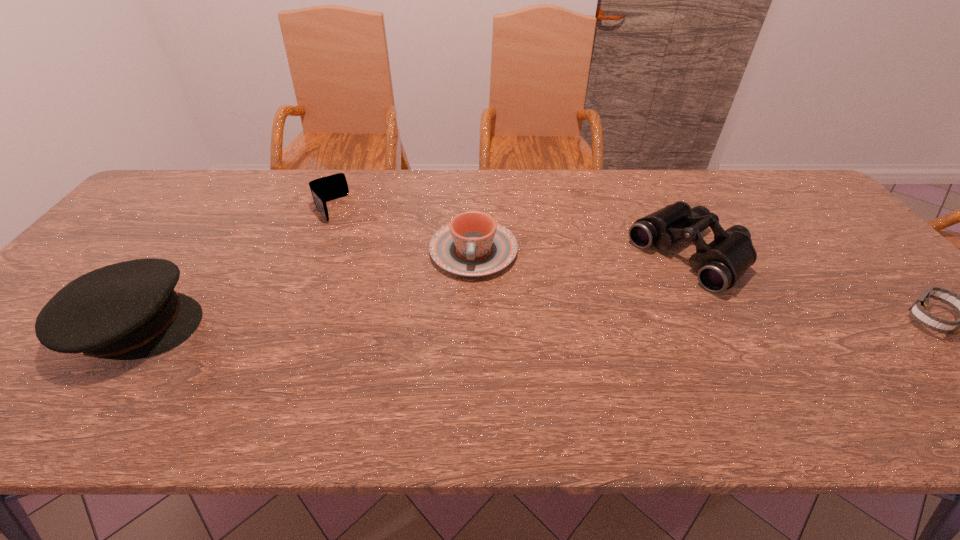
This screenshot has width=960, height=540. I want to click on vacant space at the right edge of the desktop, so click(x=816, y=259).

You are a GUI agent. You are given a task and a screenshot of the screen. Output one action in this format:
    pyautogui.click(x=<x>, y=<y>)
    Task: Click on the vacant region at the far left corner
    This screenshot has height=540, width=960.
    Given the screenshot: What is the action you would take?
    pyautogui.click(x=155, y=211)

Locate an element on the screen. The height and width of the screenshot is (540, 960). free area in between the second object from right to left and the beret is located at coordinates (413, 292).

Locate an element on the screen. free space that is in between the binoculars and the chinaware is located at coordinates (582, 254).

Locate an element on the screen. The image size is (960, 540). free point between the third object from right to left and the leftmost object is located at coordinates 305,289.

In order to click on empty space that is in between the beret and the chinaware in this screenshot , I will do `click(305, 289)`.

This screenshot has height=540, width=960. Find the location of `free spot between the third object from right to left and the fourth object from left to right`. free spot between the third object from right to left and the fourth object from left to right is located at coordinates (582, 254).

Where is `the fourth closest object to the beret`? the fourth closest object to the beret is located at coordinates (918, 309).

The height and width of the screenshot is (540, 960). Identify the location of object that can be found as the closest to the third object from right to left. (328, 188).

The height and width of the screenshot is (540, 960). I want to click on vacant space that satisfies the following two spatial constraints: 1. on the front side of the fourth object from left to right; 2. on the left side of the chinaware, so click(x=473, y=256).